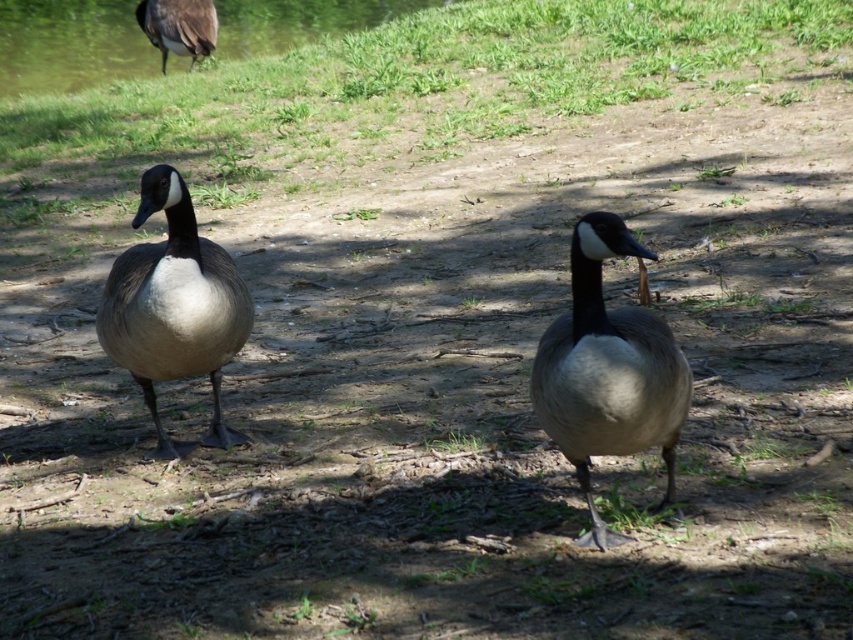
You are a nature photographer trying to capture both the matte gray goose at center and the dark gray feathers at upper left in a single frame. Since you want to ensure both are visible, which object should you focus on first to account for their size difference?

The matte gray goose at center is much taller than the dark gray feathers at upper left, so you should focus on the matte gray goose at center first to ensure its details are captured clearly before adjusting for the smaller dark gray feathers at upper left.

You are observing two geese in a shaded area. You see a matte gray goose at center and a gray matte goose at left. Which goose is positioned to the right of the other?

The matte gray goose at center is positioned to the right of the gray matte goose at left.